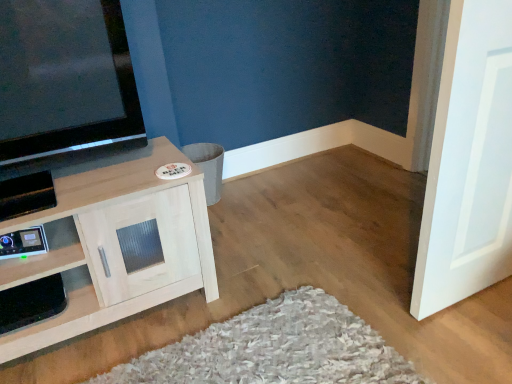
Locate an element on the screen. white matte door at right is located at coordinates (469, 162).

Describe the element at coordinates (469, 162) in the screenshot. The width and height of the screenshot is (512, 384). I see `white matte door at right` at that location.

What is the approximate height of white matte door at right?

It is 34.80 inches.

Describe the element at coordinates (117, 246) in the screenshot. I see `light wood cabinet at left` at that location.

In order to face light wood cabinet at left, should I rotate leftwards or rightwards?

Rotate your view left by about 21.021°.

Locate an element on the screen. This screenshot has width=512, height=384. light wood cabinet at left is located at coordinates (117, 246).

The image size is (512, 384). In order to click on white matte door at right in this screenshot , I will do `click(469, 162)`.

Considering the positions of objects white matte door at right and light wood cabinet at left in the image provided, who is more to the right, white matte door at right or light wood cabinet at left?

white matte door at right.

Between white matte door at right and light wood cabinet at left, which one is positioned in front?

white matte door at right.

Is point (457, 300) in front of point (120, 299)?

No, it is not.

From the image's perspective, is white matte door at right under light wood cabinet at left?

No.

From a real-world perspective, which is physically above, white matte door at right or light wood cabinet at left?

white matte door at right, from a real-world perspective.

Does white matte door at right have a lesser width compared to light wood cabinet at left?

Correct, the width of white matte door at right is less than that of light wood cabinet at left.

Is white matte door at right taller than light wood cabinet at left?

Yes.

Who is smaller, white matte door at right or light wood cabinet at left?

white matte door at right is smaller.

Is white matte door at right outside of light wood cabinet at left?

white matte door at right lies outside light wood cabinet at left's area.

Is white matte door at right touching light wood cabinet at left?

No, white matte door at right is not in contact with light wood cabinet at left.

In the scene shown: Is white matte door at right positioned with its back to light wood cabinet at left?

white matte door at right is not turned away from light wood cabinet at left.

How much distance is there between white matte door at right and light wood cabinet at left?

32.25 inches.

This screenshot has width=512, height=384. What are the coordinates of `cabinetry that is below the white matte door at right (from the image's perspective)` in the screenshot? It's located at (117, 246).

Does light wood cabinet at left appear on the right side of white matte door at right?

No.

Considering their positions, is light wood cabinet at left located in front of or behind white matte door at right?

Visually, light wood cabinet at left is located behind white matte door at right.

Is point (101, 289) in front of point (442, 234)?

No.

From the image's perspective, which one is positioned higher, light wood cabinet at left or white matte door at right?

white matte door at right is shown above in the image.

Looking at this image, from a real-world perspective, relative to white matte door at right, is light wood cabinet at left vertically above or below?

From a real-world perspective, light wood cabinet at left is physically below white matte door at right.

Between light wood cabinet at left and white matte door at right, which one has smaller width?

With smaller width is white matte door at right.

Which of these two, light wood cabinet at left or white matte door at right, stands taller?

Standing taller between the two is white matte door at right.

Does light wood cabinet at left have a larger size compared to white matte door at right?

Yes, light wood cabinet at left is bigger than white matte door at right.

Is light wood cabinet at left not inside white matte door at right?

light wood cabinet at left lies outside white matte door at right's area.

Is light wood cabinet at left placed right next to white matte door at right?

No.

Is white matte door at right at the back of light wood cabinet at left?

No, light wood cabinet at left's orientation is not away from white matte door at right.

At what (x,y) coordinates should I click in order to perform the action: click on door located above the light wood cabinet at left (from the image's perspective). Please return your answer as a coordinate pair (x, y). The height and width of the screenshot is (384, 512). Looking at the image, I should click on (469, 162).

You are a GUI agent. You are given a task and a screenshot of the screen. Output one action in this format:
    pyautogui.click(x=<x>, y=<y>)
    Task: Click on the cabinetry that is under the white matte door at right (from a real-world perspective)
    The image size is (512, 384).
    Given the screenshot: What is the action you would take?
    pyautogui.click(x=117, y=246)

Where is `cabinetry that appears behind the white matte door at right`? Image resolution: width=512 pixels, height=384 pixels. cabinetry that appears behind the white matte door at right is located at coordinates coord(117,246).